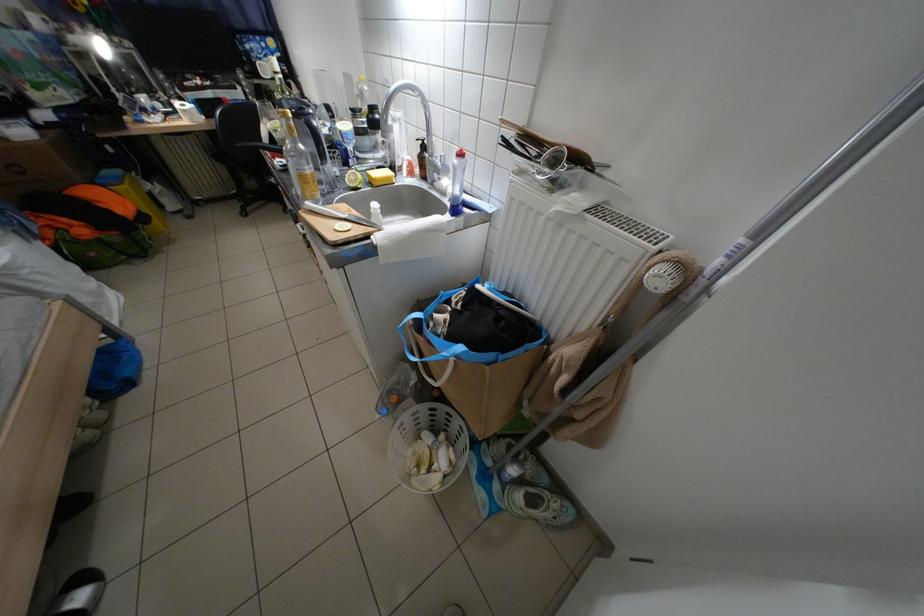
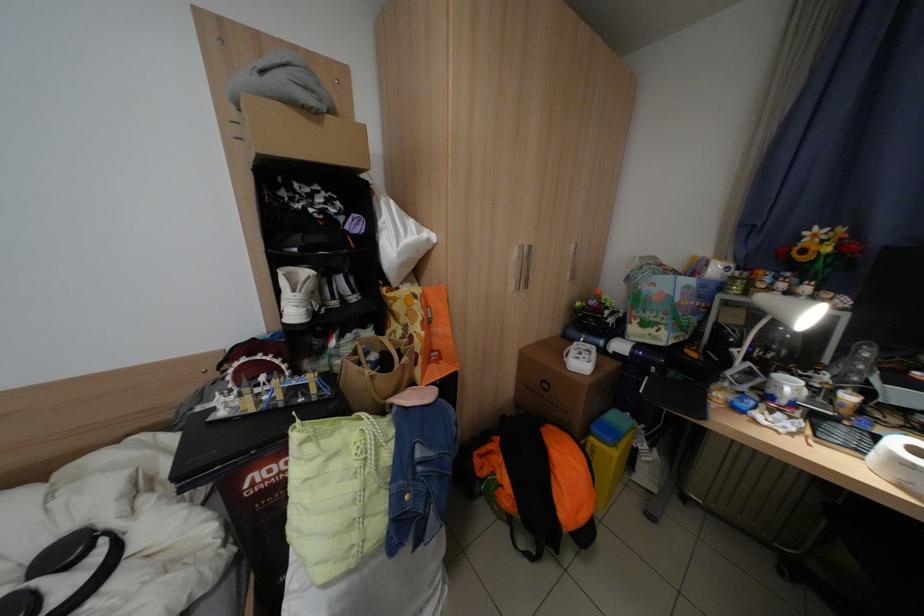
In the second image, find the point that corresponds to [120,213] in the first image.

(565, 508)